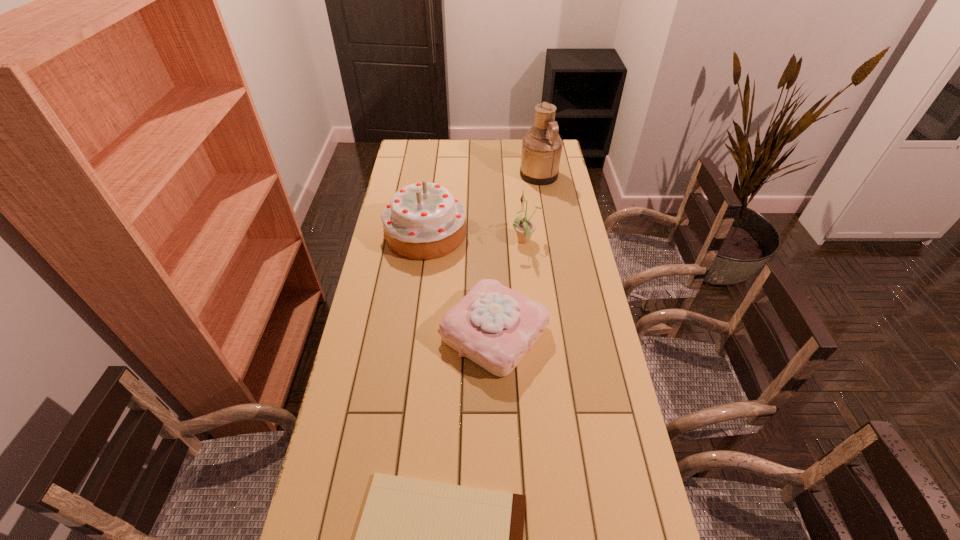
This screenshot has height=540, width=960. In order to click on the farthest object in this screenshot , I will do `click(541, 147)`.

The image size is (960, 540). I want to click on pitcher, so click(x=541, y=147).

Identify the location of sunflower. (524, 227).

Image resolution: width=960 pixels, height=540 pixels. In order to click on the farther cake in this screenshot , I will do `click(422, 221)`.

Where is `the fourth farthest object`? This screenshot has height=540, width=960. the fourth farthest object is located at coordinates (494, 326).

You are a GUI agent. You are given a task and a screenshot of the screen. Output one action in this format:
    pyautogui.click(x=<x>, y=<y>)
    Task: Click on the shorter cake
    
    Given the screenshot: What is the action you would take?
    pyautogui.click(x=494, y=326)

Find the location of a particular element. This screenshot has height=540, width=960. vacant space located 0.260m on the left of the pitcher is located at coordinates (464, 175).

You are a GUI agent. You are given a task and a screenshot of the screen. Output one action in this format:
    pyautogui.click(x=<x>, y=<y>)
    Task: Click on the vacant area located 0.230m on the front-facing side of the sunflower
    
    Given the screenshot: What is the action you would take?
    pyautogui.click(x=451, y=241)

The image size is (960, 540). Find the location of `free space located 0.220m on the front-facing side of the sunflower`. free space located 0.220m on the front-facing side of the sunflower is located at coordinates (454, 241).

This screenshot has height=540, width=960. Find the location of `free location located 0.270m on the front-facing side of the sunflower`. free location located 0.270m on the front-facing side of the sunflower is located at coordinates (442, 241).